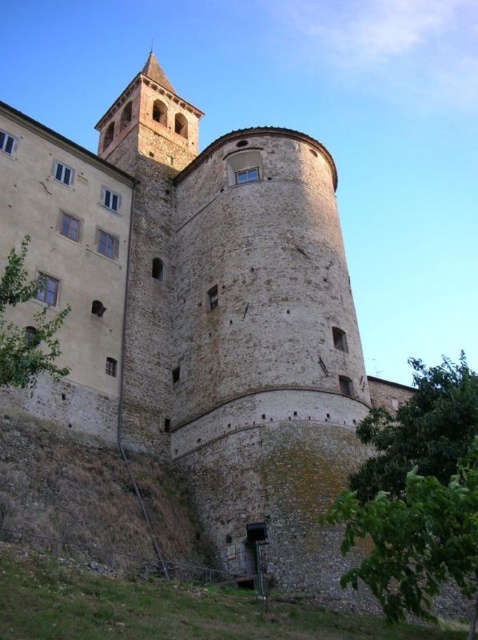
You are standing at the center of the image and want to locate the green leafy tree at lower right. In which direction should you turn to face the tree?

The green leafy tree at lower right is located at point (416, 493), which is to the lower right of the center. To face the tree, you should turn to your lower right direction.